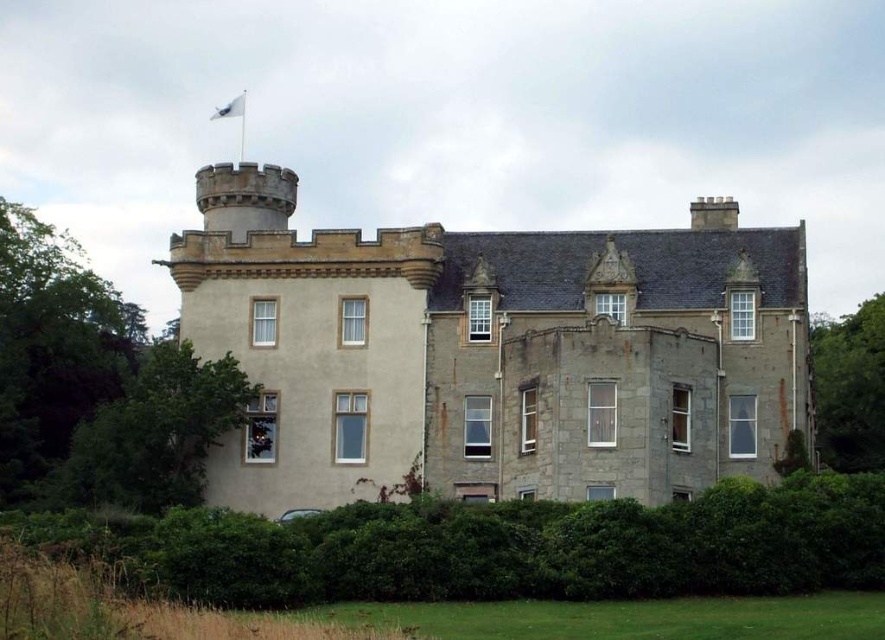
Question: Does green leafy hedge at lower center appear over green leafy tree at right?

Choices:
 (A) no
 (B) yes

Answer: (A)

Question: Which point is farther from the camera taking this photo?

Choices:
 (A) click(177, 438)
 (B) click(503, 241)
 (C) click(882, 316)
 (D) click(4, 461)

Answer: (C)

Question: Which of these objects is positioned closest to the white fabric flag at upper center?

Choices:
 (A) green leafy tree at right
 (B) green leafy tree at left
 (C) stone castle at center

Answer: (B)

Question: Can you confirm if green leafy tree at left is smaller than white fabric flag at upper center?

Choices:
 (A) no
 (B) yes

Answer: (A)

Question: Does stone castle at center have a greater width compared to green leafy hedge at lower center?

Choices:
 (A) yes
 (B) no

Answer: (B)

Question: Which object appears closest to the camera in this image?

Choices:
 (A) green leafy hedge at lower center
 (B) stone castle at center
 (C) green leafy tree at lower left
 (D) white fabric flag at upper center

Answer: (A)